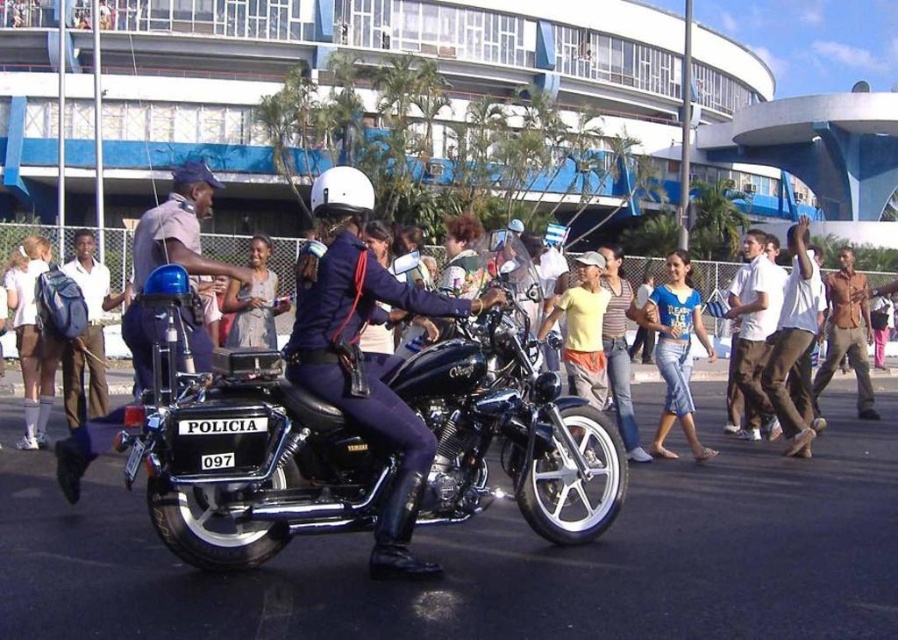
Which is above, shiny blue uniform at center or brown cotton pants at right?

brown cotton pants at right

Which is behind, point (403, 531) or point (793, 326)?

Point (793, 326)

Which is in front, point (288, 356) or point (768, 362)?

Point (288, 356) is in front.

You are a GUI agent. You are given a task and a screenshot of the screen. Output one action in this format:
    pyautogui.click(x=<x>, y=<y>)
    Task: Click on the shiny blue uniform at center
    The width and height of the screenshot is (898, 640).
    Given the screenshot: What is the action you would take?
    (x=366, y=353)

Who is shorter, dark blue uniform at center or white cotton shirt at right?

white cotton shirt at right is shorter.

Can you confirm if dark blue uniform at center is positioned to the left of white cotton shirt at right?

Indeed, dark blue uniform at center is positioned on the left side of white cotton shirt at right.

The image size is (898, 640). Describe the element at coordinates (172, 253) in the screenshot. I see `dark blue uniform at center` at that location.

You are a GUI agent. You are given a task and a screenshot of the screen. Output one action in this format:
    pyautogui.click(x=<x>, y=<y>)
    Task: Click on the dark blue uniform at center
    This screenshot has width=898, height=640.
    Given the screenshot: What is the action you would take?
    (172, 253)

The height and width of the screenshot is (640, 898). What do you see at coordinates (172, 253) in the screenshot? I see `dark blue uniform at center` at bounding box center [172, 253].

From the picture: How far apart are dark blue uniform at center and blue denim jeans at center?

dark blue uniform at center is 5.26 meters away from blue denim jeans at center.

You are a GUI agent. You are given a task and a screenshot of the screen. Output one action in this format:
    pyautogui.click(x=<x>, y=<y>)
    Task: Click on the dark blue uniform at center
    The width and height of the screenshot is (898, 640).
    Given the screenshot: What is the action you would take?
    pyautogui.click(x=172, y=253)